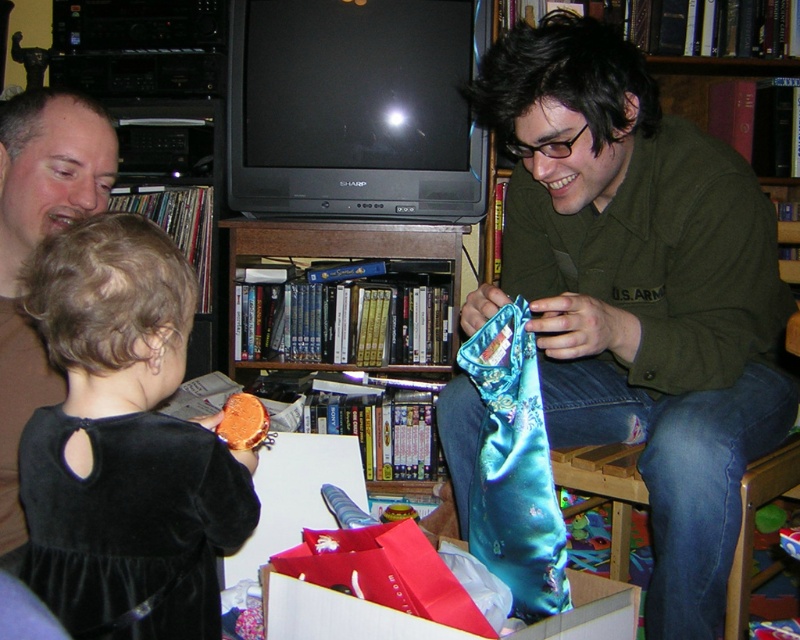
Question: Is velvet black dress at left positioned before brown velvet shirt at upper left?

Choices:
 (A) no
 (B) yes

Answer: (B)

Question: Which of the following is the farthest from the observer?

Choices:
 (A) shiny wood bookshelf at center
 (B) shiny blue silk pouch at center
 (C) velvet black dress at left

Answer: (A)

Question: Can you confirm if shiny blue silk pouch at center is smaller than brown velvet shirt at upper left?

Choices:
 (A) no
 (B) yes

Answer: (A)

Question: Can you confirm if velvet black dress at left is positioned above shiny wood bookshelf at center?

Choices:
 (A) no
 (B) yes

Answer: (A)

Question: Among these objects, which one is farthest from the camera?

Choices:
 (A) velvet black dress at left
 (B) shiny blue silk pouch at center
 (C) teal satin tie at center

Answer: (B)

Question: Among these points, which one is farthest from the camera?

Choices:
 (A) (122, 387)
 (B) (249, 259)
 (C) (548, 468)
 (D) (556, 170)

Answer: (B)